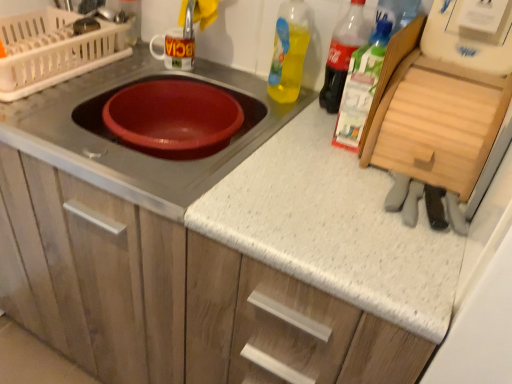
Find the location of a particular element. This screenshot has width=512, height=384. vacant area that is in front of translucent plastic bottle at upper right, placed as the third bottle when sorted from left to right is located at coordinates (336, 168).